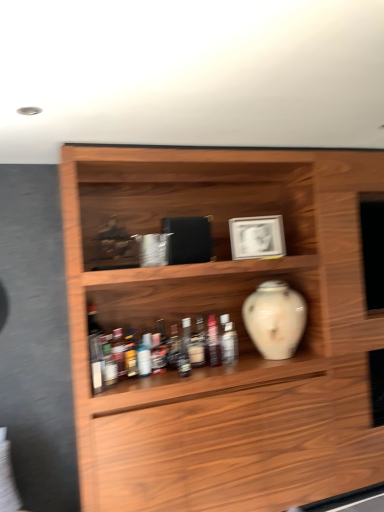
Question: In the image, is translucent glass bottle at center, which is counted as the first bottle, starting from the back, positioned in front of or behind translucent plastic bottles at lower center, placed as the 1th bottle when sorted from left to right?

Choices:
 (A) front
 (B) behind

Answer: (B)

Question: Is translucent glass bottle at center, which is counted as the first bottle, starting from the back, wider or thinner than translucent plastic bottles at lower center, which is the third bottle from back to front?

Choices:
 (A) wide
 (B) thin

Answer: (B)

Question: Considering the real-world distances, which object is farthest from the translucent glass bottle at center, the third bottle positioned from the front?

Choices:
 (A) translucent plastic bottles at lower center, placed as the 1th bottle when sorted from left to right
 (B) wooden shelf at center
 (C) translucent plastic bottle at center, the third bottle when ordered from left to right
 (D) white matte picture frame at upper center
 (E) white glossy vase at center

Answer: (B)

Question: Which object is the closest to the translucent plastic bottles at lower center, which is the third bottle from back to front?

Choices:
 (A) white matte picture frame at upper center
 (B) wooden shelf at center
 (C) translucent glass bottle at center, arranged as the second bottle when viewed from the right
 (D) translucent plastic bottle at center, the third bottle when ordered from left to right
 (E) white glossy vase at center

Answer: (C)